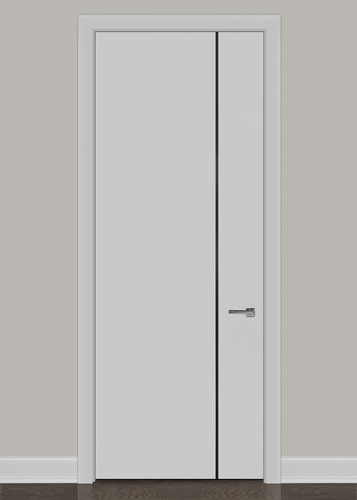
Where is `wall left of door`? The width and height of the screenshot is (357, 500). wall left of door is located at coordinates (25, 211).